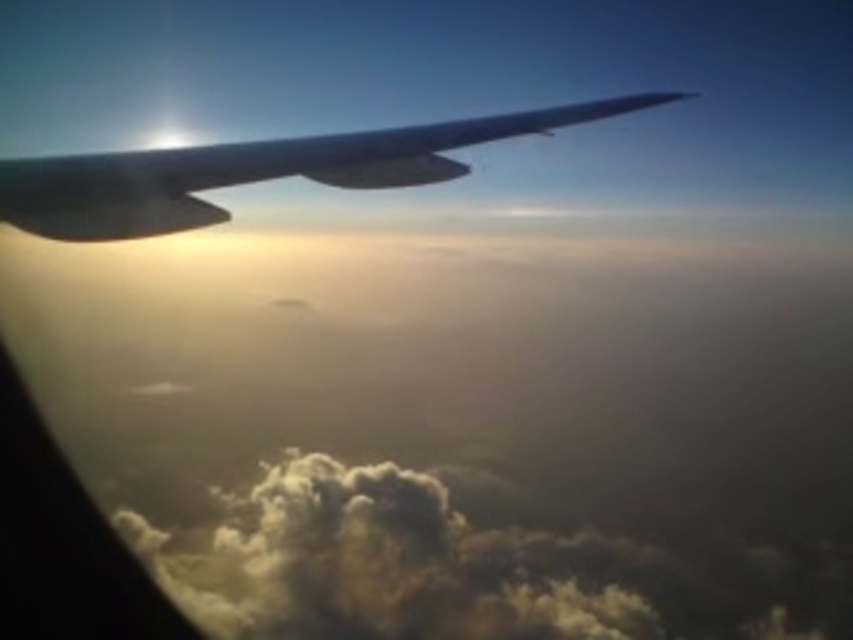
Question: In this image, where is cloudy white at lower left located relative to satin black wing at upper left?

Choices:
 (A) left
 (B) right

Answer: (B)

Question: Is cloudy white at lower left thinner than satin black wing at upper left?

Choices:
 (A) no
 (B) yes

Answer: (A)

Question: Can you confirm if cloudy white at lower left is positioned below satin black wing at upper left?

Choices:
 (A) yes
 (B) no

Answer: (A)

Question: Among these points, which one is nearest to the camera?

Choices:
 (A) (358, 173)
 (B) (318, 600)

Answer: (A)